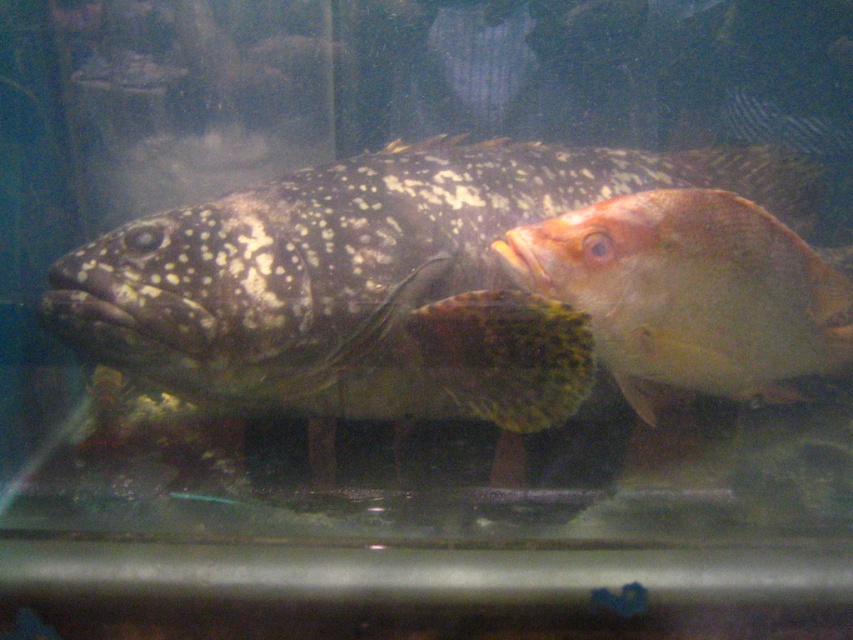
Can you confirm if speckled matte fish at center is smaller than shiny orange fish at right?

Incorrect, speckled matte fish at center is not smaller in size than shiny orange fish at right.

Can you confirm if speckled matte fish at center is positioned to the left of shiny orange fish at right?

Indeed, speckled matte fish at center is positioned on the left side of shiny orange fish at right.

What do you see at coordinates (364, 285) in the screenshot?
I see `speckled matte fish at center` at bounding box center [364, 285].

The width and height of the screenshot is (853, 640). What are the coordinates of `speckled matte fish at center` in the screenshot? It's located at (364, 285).